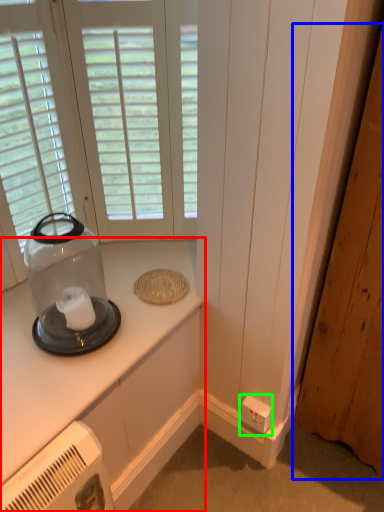
Question: Based on their relative distances, which object is farther from countertop (highlighted by a red box)? Choose from door (highlighted by a blue box) and electric outlet (highlighted by a green box).

Choices:
 (A) door
 (B) electric outlet

Answer: (A)